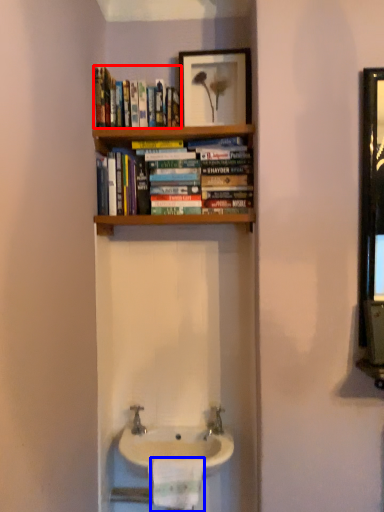
Question: Which object is closer to the camera taking this photo, book (highlighted by a red box) or toilet paper (highlighted by a blue box)?

Choices:
 (A) book
 (B) toilet paper

Answer: (B)